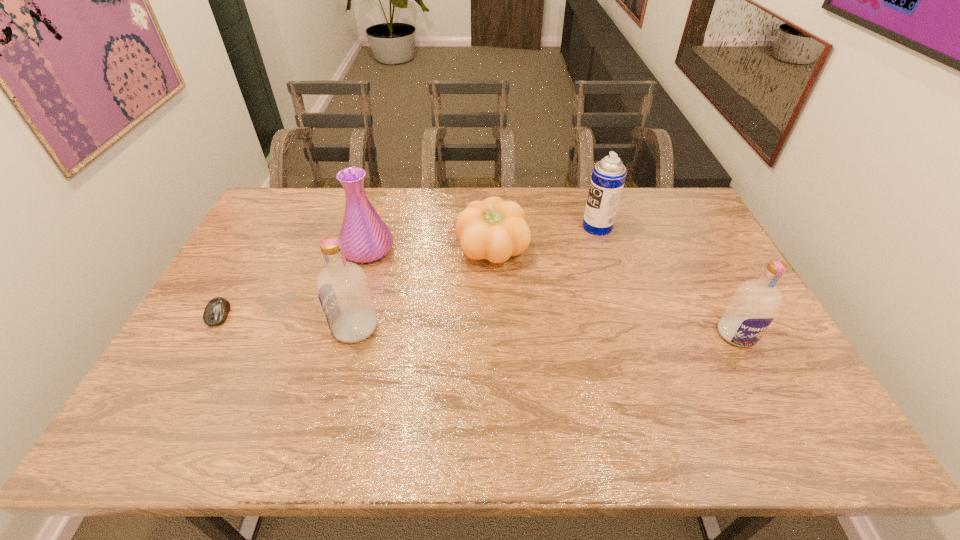
Locate an element on the screen. Image resolution: width=960 pixels, height=540 pixels. vacant space located on the label of the taller vodka is located at coordinates (273, 328).

Where is `blank space located on the label of the taller vodka`? The width and height of the screenshot is (960, 540). blank space located on the label of the taller vodka is located at coordinates (218, 328).

Image resolution: width=960 pixels, height=540 pixels. What are the coordinates of `vacant space located 0.330m on the label side of the second object from right to left` in the screenshot? It's located at (486, 227).

Locate an element on the screen. The height and width of the screenshot is (540, 960). free spot located 0.120m on the label side of the second object from right to left is located at coordinates (547, 227).

Identify the location of free region located on the label side of the second object from right to left. The image size is (960, 540). (564, 227).

The height and width of the screenshot is (540, 960). What are the coordinates of `free space located 0.390m on the right of the vase` in the screenshot? It's located at (515, 250).

The height and width of the screenshot is (540, 960). I want to click on vacant point located on the right of the shortest object, so click(348, 315).

At what (x,y) coordinates should I click in order to perform the action: click on vacant space located on the front of the fourth object from left to right. Please return your answer as a coordinate pair (x, y). Looking at the image, I should click on tap(494, 313).

Where is `object located in the far edge section of the desktop`? The image size is (960, 540). object located in the far edge section of the desktop is located at coordinates (608, 176).

Identify the location of object that is positioned at the left edge. This screenshot has height=540, width=960. (216, 311).